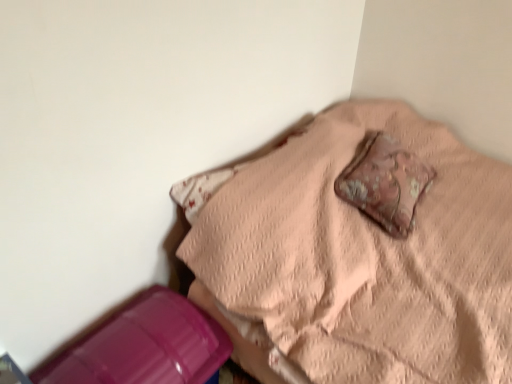
Question: Looking at the image, does pink quilted bedspread at upper center seem bigger or smaller compared to rusty fabric pillow at center?

Choices:
 (A) small
 (B) big

Answer: (B)

Question: From the image's perspective, is pink quilted bedspread at upper center above or below rusty fabric pillow at center?

Choices:
 (A) above
 (B) below

Answer: (B)

Question: Considering the positions of pink quilted bedspread at upper center and rusty fabric pillow at center in the image, is pink quilted bedspread at upper center wider or thinner than rusty fabric pillow at center?

Choices:
 (A) thin
 (B) wide

Answer: (B)

Question: Looking at their shapes, would you say rusty fabric pillow at center is wider or thinner than pink quilted bedspread at upper center?

Choices:
 (A) thin
 (B) wide

Answer: (A)

Question: In the image, is rusty fabric pillow at center on the left side or the right side of pink quilted bedspread at upper center?

Choices:
 (A) right
 (B) left

Answer: (A)

Question: Is point (373, 213) closer or farther from the camera than point (437, 355)?

Choices:
 (A) farther
 (B) closer

Answer: (A)

Question: Would you say rusty fabric pillow at center is inside or outside pink quilted bedspread at upper center?

Choices:
 (A) outside
 (B) inside

Answer: (B)